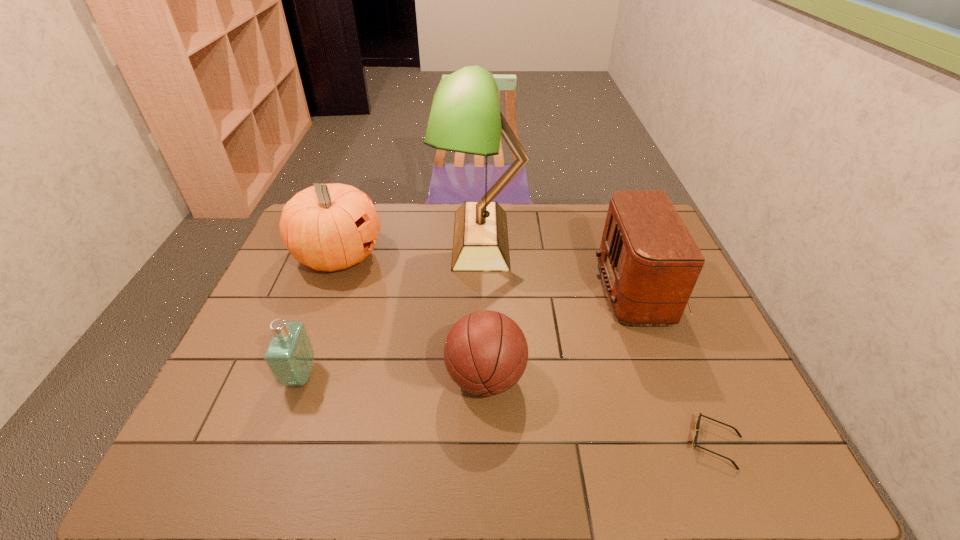
What are the coordinates of `vacant space at the left edge` in the screenshot? It's located at (303, 271).

Find the location of a particular element. The width and height of the screenshot is (960, 540). vacant space at the right edge is located at coordinates (750, 397).

This screenshot has height=540, width=960. Find the location of `free spot between the radio receiver and the tallest object`. free spot between the radio receiver and the tallest object is located at coordinates (564, 265).

Image resolution: width=960 pixels, height=540 pixels. In order to click on unoccupied position between the tallest object and the pumpkin in this screenshot , I will do `click(410, 247)`.

You are a GUI agent. You are given a task and a screenshot of the screen. Output one action in this format:
    pyautogui.click(x=<x>, y=<y>)
    Task: Click on the free space between the radio receiver and the pumpkin
    
    Given the screenshot: What is the action you would take?
    pyautogui.click(x=492, y=273)

This screenshot has width=960, height=540. Find the location of `vacant area between the table lamp and the perfume`. vacant area between the table lamp and the perfume is located at coordinates (391, 308).

Find the location of a particular element. free spot between the tallest object and the perfume is located at coordinates (391, 308).

The width and height of the screenshot is (960, 540). I want to click on free spot between the table lamp and the basketball, so click(483, 309).

Identify the location of empty location between the radio receiver and the nearest object. (681, 367).

This screenshot has width=960, height=540. I want to click on object that ranks as the fourth closest to the sunglasses, so click(289, 356).